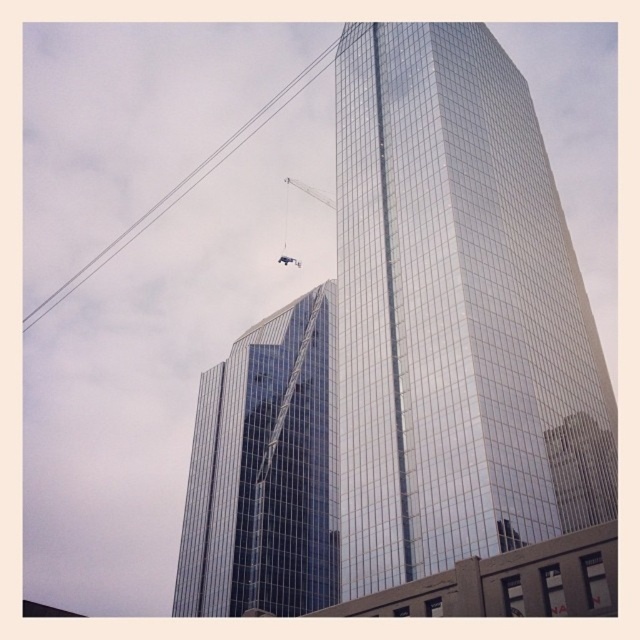
Question: Among these points, which one is farthest from the camera?

Choices:
 (A) (323, 202)
 (B) (502, 449)
 (C) (276, 388)

Answer: (A)

Question: Observing the image, what is the correct spatial positioning of glossy glass tower at center in reference to shiny glass building at center?

Choices:
 (A) right
 (B) left

Answer: (A)

Question: Observing the image, what is the correct spatial positioning of shiny glass building at center in reference to black wire at upper left?

Choices:
 (A) below
 (B) above

Answer: (A)

Question: Among these objects, which one is farthest from the camera?

Choices:
 (A) glossy glass tower at center
 (B) shiny glass building at center
 (C) metallic silver crane at upper center

Answer: (C)

Question: Is glossy glass tower at center wider than metallic silver crane at upper center?

Choices:
 (A) yes
 (B) no

Answer: (A)

Question: Which is nearer to the glossy glass tower at center?

Choices:
 (A) black wire at upper left
 (B) metallic silver crane at upper center
 (C) shiny glass building at center

Answer: (C)